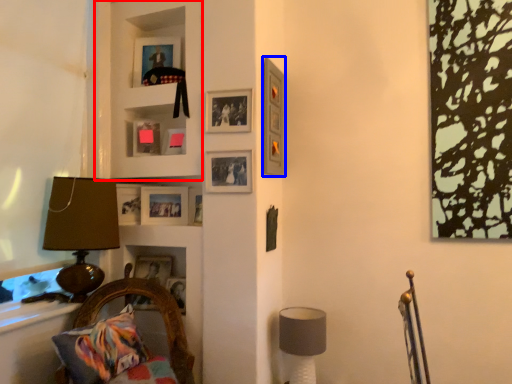
Question: Which point is closer to the camera, cabinet (highlighted by a red box) or picture frame (highlighted by a blue box)?

Choices:
 (A) cabinet
 (B) picture frame

Answer: (B)